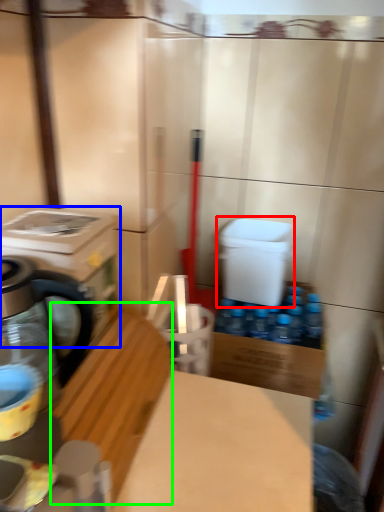
Question: Estimate the real-world distances between objects in this image. Which object is farther from water cooler (highlighted by a red box), washing machine (highlighted by a blue box) or wood (highlighted by a green box)?

Choices:
 (A) washing machine
 (B) wood

Answer: (A)